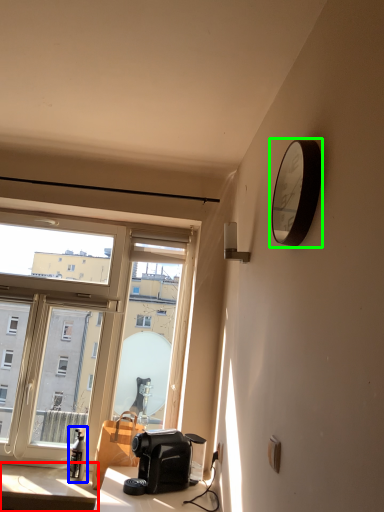
Question: Estimate the real-world distances between objects in this image. Which object is farther from table (highlighted by a red box), bottle (highlighted by a blue box) or clock (highlighted by a green box)?

Choices:
 (A) bottle
 (B) clock

Answer: (B)